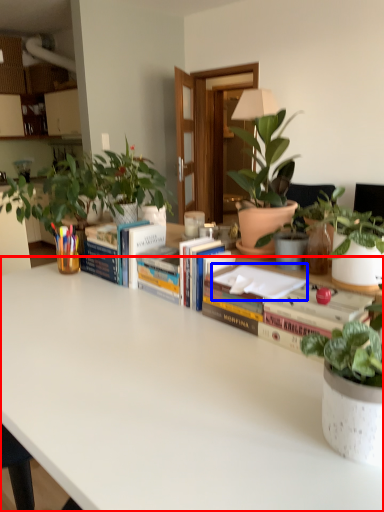
Question: Among these objects, which one is nearest to the camera, table (highlighted by a red box) or paperback book (highlighted by a blue box)?

Choices:
 (A) table
 (B) paperback book

Answer: (A)